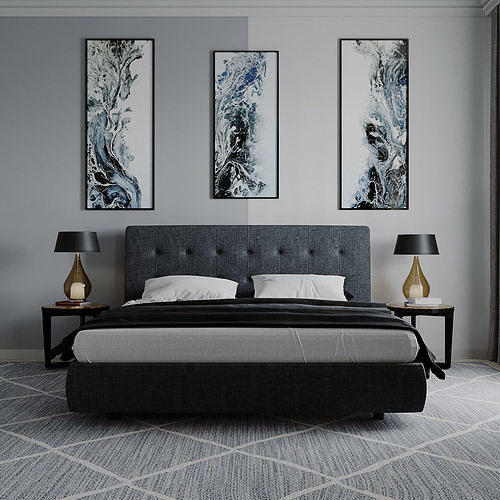
Where is `wall`? The width and height of the screenshot is (500, 500). wall is located at coordinates (51, 151), (193, 173), (310, 170), (459, 193).